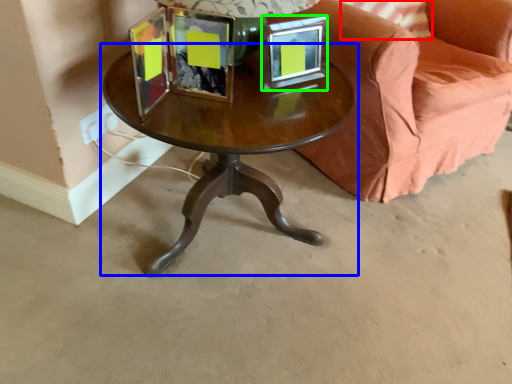
Question: Which is nearer to the pillow (highlighted by a red box)? coffee table (highlighted by a blue box) or picture frame (highlighted by a green box).

Choices:
 (A) coffee table
 (B) picture frame

Answer: (B)